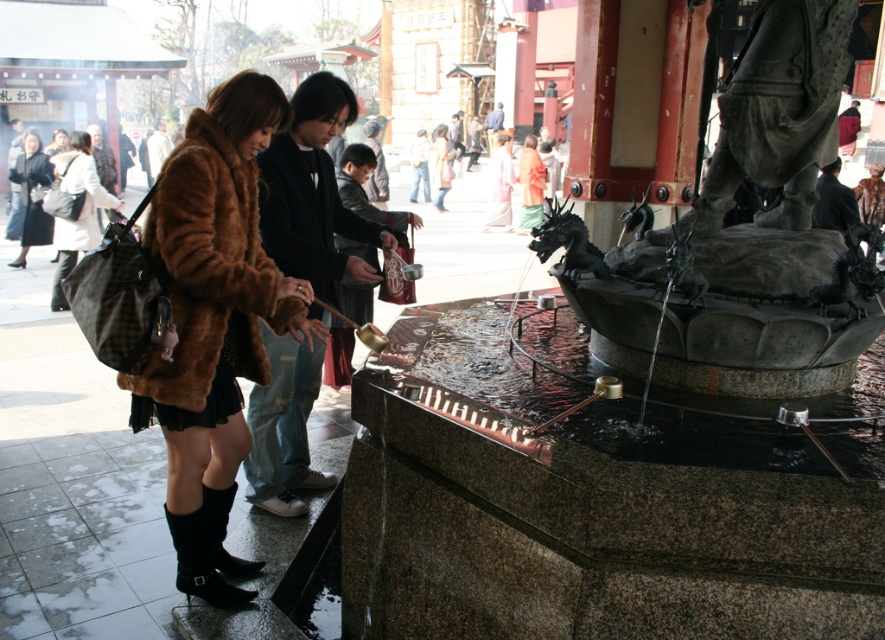
Question: Is brown furry coat at left behind fur coat at left?

Choices:
 (A) yes
 (B) no

Answer: (B)

Question: Does fur coat at left appear over matte brown fur coat at center?

Choices:
 (A) yes
 (B) no

Answer: (B)

Question: Which point appears farthest from the camera in this image?

Choices:
 (A) (214, 490)
 (B) (22, 252)
 (C) (704, 360)
 (D) (121, 372)

Answer: (B)

Question: Can you confirm if dark gray stone statue at center is thinner than brown furry coat at left?

Choices:
 (A) yes
 (B) no

Answer: (B)

Question: Which object is positioned closest to the pink silk kimono at center?

Choices:
 (A) black suede boot at lower left
 (B) fur coat at left
 (C) brown furry coat at left
 (D) dark gray stone statue at center

Answer: (D)

Question: Estimate the real-world distances between objects in this image. Which object is farther from the matte brown fur coat at left?

Choices:
 (A) pink silk kimono at center
 (B) dark gray stone statue at center
 (C) brown furry coat at left
 (D) fur coat at left

Answer: (A)